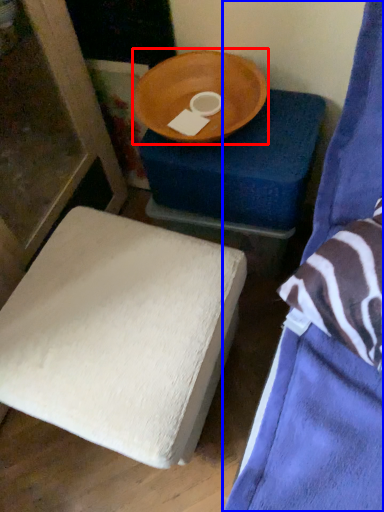
Question: Which object appears farthest to the camera in this image, round table (highlighted by a red box) or furniture (highlighted by a blue box)?

Choices:
 (A) round table
 (B) furniture

Answer: (A)